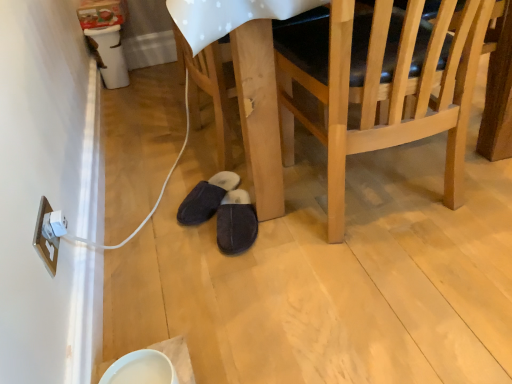
Question: Can you confirm if white plastic electric outlet at lower left is taller than light wood chair at center?

Choices:
 (A) yes
 (B) no

Answer: (B)

Question: Does white plastic electric outlet at lower left turn towards light wood chair at center?

Choices:
 (A) no
 (B) yes

Answer: (B)

Question: Is white plastic electric outlet at lower left turned away from light wood chair at center?

Choices:
 (A) yes
 (B) no

Answer: (B)

Question: Does white plastic electric outlet at lower left have a lesser width compared to light wood chair at center?

Choices:
 (A) no
 (B) yes

Answer: (B)

Question: From a real-world perspective, is white plastic electric outlet at lower left on top of light wood chair at center?

Choices:
 (A) yes
 (B) no

Answer: (B)

Question: Choose the correct answer: Is white plastic electric outlet at lower left inside dark gray suede slippers at lower center, placed as the 2th footwear when sorted from left to right, or outside it?

Choices:
 (A) outside
 (B) inside

Answer: (A)

Question: From a real-world perspective, is white plastic electric outlet at lower left above or below dark gray suede slippers at lower center, the 1th footwear from the right?

Choices:
 (A) below
 (B) above

Answer: (B)

Question: Is white plastic electric outlet at lower left taller or shorter than dark gray suede slippers at lower center, placed as the 2th footwear when sorted from left to right?

Choices:
 (A) short
 (B) tall

Answer: (A)

Question: Visually, is white plastic electric outlet at lower left positioned to the left or to the right of dark gray suede slippers at lower center, placed as the 2th footwear when sorted from left to right?

Choices:
 (A) left
 (B) right

Answer: (A)

Question: From a real-world perspective, is white plastic electric outlet at lower left above or below black suede slippers at lower center, the first footwear viewed from the left?

Choices:
 (A) below
 (B) above

Answer: (B)

Question: In terms of size, does white plastic electric outlet at lower left appear bigger or smaller than black suede slippers at lower center, the 2th footwear positioned from the right?

Choices:
 (A) big
 (B) small

Answer: (B)

Question: Considering the positions of point (46, 259) and point (204, 185), is point (46, 259) closer or farther from the camera than point (204, 185)?

Choices:
 (A) farther
 (B) closer

Answer: (B)

Question: Is white plastic electric outlet at lower left taller or shorter than black suede slippers at lower center, the first footwear viewed from the left?

Choices:
 (A) short
 (B) tall

Answer: (B)

Question: Choose the correct answer: Is white plastic electric outlet at lower left inside light wood chair at center or outside it?

Choices:
 (A) inside
 (B) outside

Answer: (B)

Question: Is white plastic electric outlet at lower left to the left or to the right of light wood chair at center in the image?

Choices:
 (A) left
 (B) right

Answer: (A)